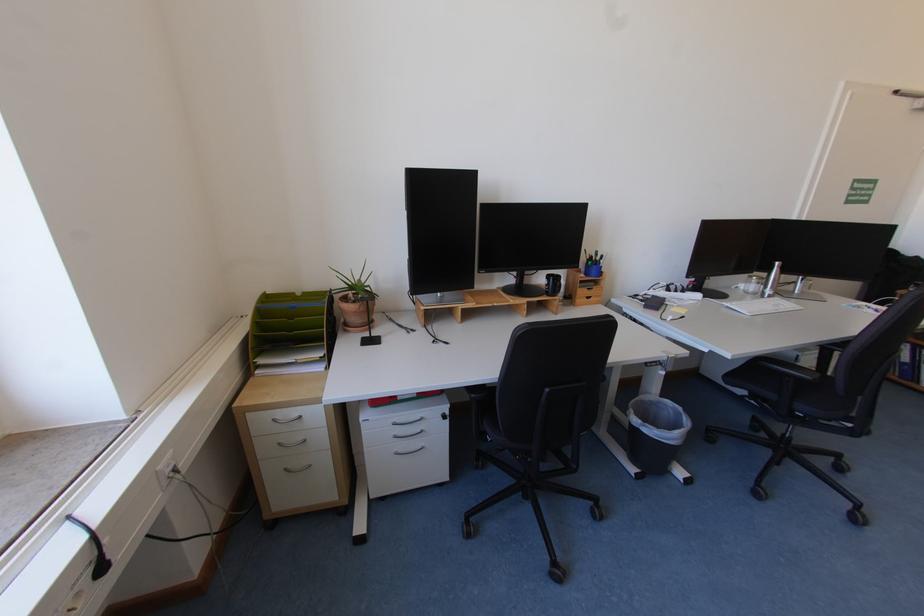
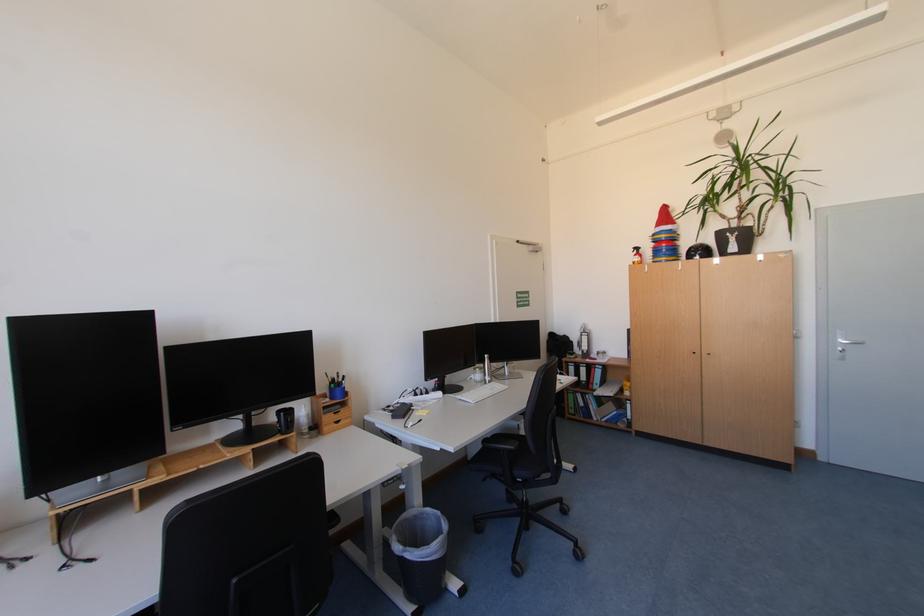
Locate, in the second image, the point that corresponds to the point at 573,302 in the first image.

(321, 432)